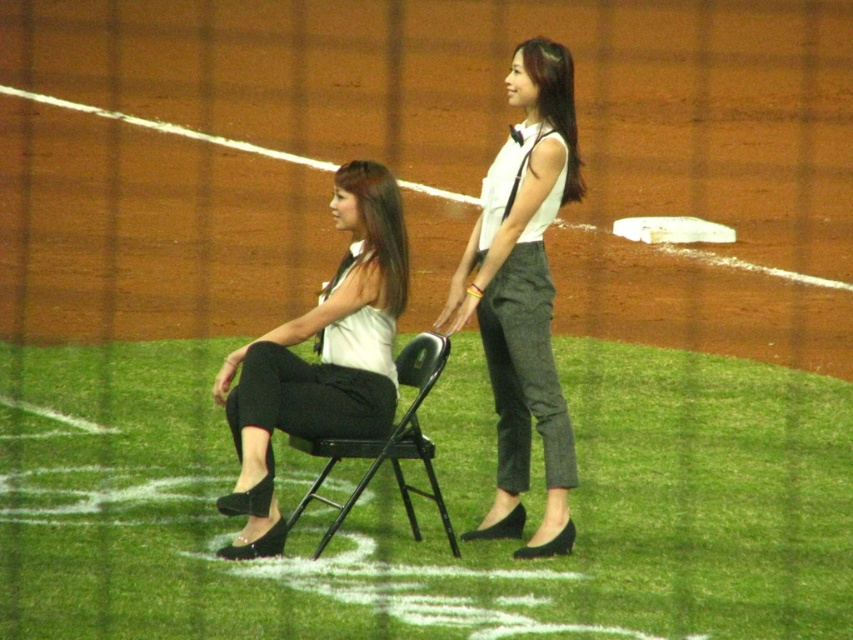
You are a fashion designer observing two models wearing different pants on a sports field. The models are wearing white textured pants at center and matte black pants at center. Which pair of pants is narrower in width?

The white textured pants at center are narrower in width than the matte black pants at center according to the description.

You are a photographer setting up for a photoshoot on the baseball field. You need to place a new prop between the white textured pants at center and the black metal chair at center. According to the scene description, where should you position the prop?

The white textured pants at center is positioned on the right side of black metal chair at center, so you should place the prop between them by positioning it to the right of the black metal chair at center and to the left of the white textured pants at center.